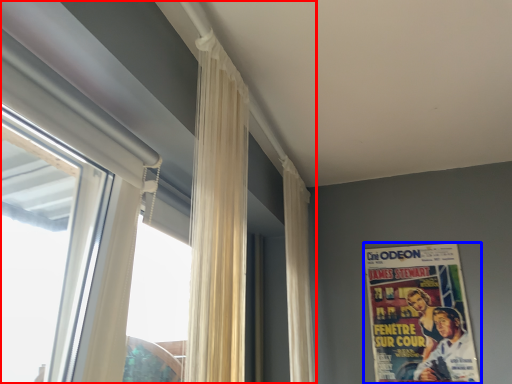
Question: Which object appears farthest to the camera in this image, window (highlighted by a red box) or poster (highlighted by a blue box)?

Choices:
 (A) window
 (B) poster

Answer: (B)